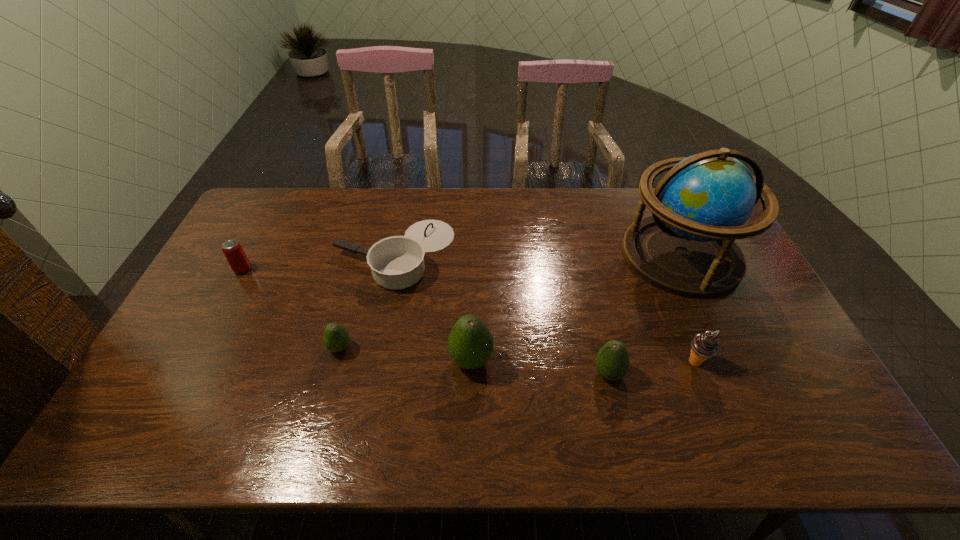
Locate an element on the screen. This screenshot has width=960, height=540. free spot that satisfies the following two spatial constraints: 1. on the front side of the second tallest avocado; 2. on the left side of the shortest object is located at coordinates (371, 374).

Identify the location of blank area in the image that satisfies the following two spatial constraints: 1. on the front side of the leftmost object; 2. on the left side of the third object from right to left. The image size is (960, 540). (187, 374).